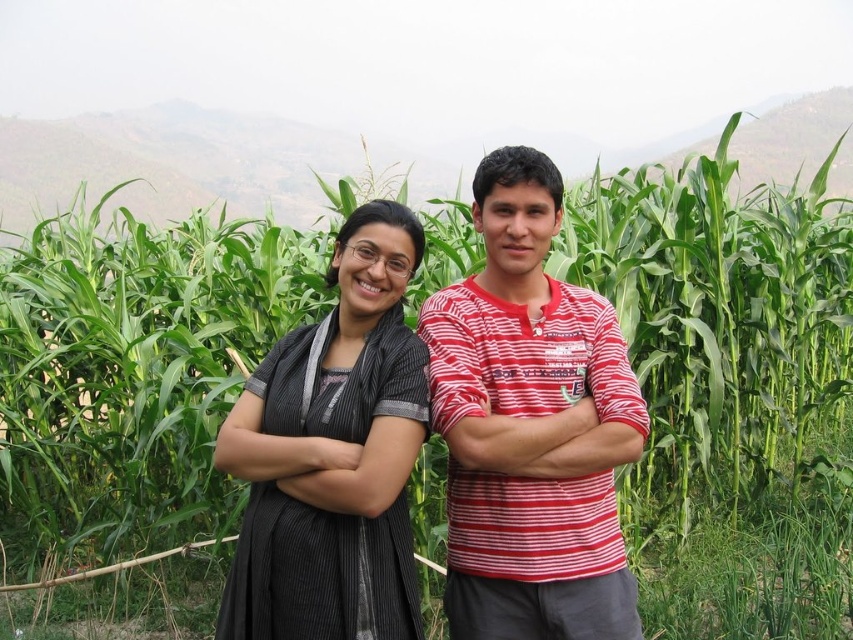
Question: Does striped cotton shirt at center lie in front of matte black dress at center?

Choices:
 (A) yes
 (B) no

Answer: (B)

Question: Which point is farther to the camera?

Choices:
 (A) (422, 317)
 (B) (357, 260)

Answer: (A)

Question: Among these points, which one is nearest to the camera?

Choices:
 (A) (514, 198)
 (B) (292, 611)

Answer: (B)

Question: Which point is farther to the camera?

Choices:
 (A) (503, 563)
 (B) (318, 352)

Answer: (B)

Question: Can you confirm if striped cotton shirt at center is positioned below matte black dress at center?

Choices:
 (A) yes
 (B) no

Answer: (B)

Question: Is striped cotton shirt at center below matte black dress at center?

Choices:
 (A) yes
 (B) no

Answer: (B)